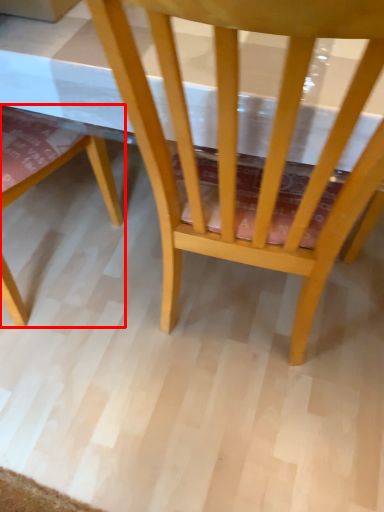
Question: From the image's perspective, what is the correct spatial positioning of chair (annotated by the red box) in reference to chair?

Choices:
 (A) below
 (B) above

Answer: (A)